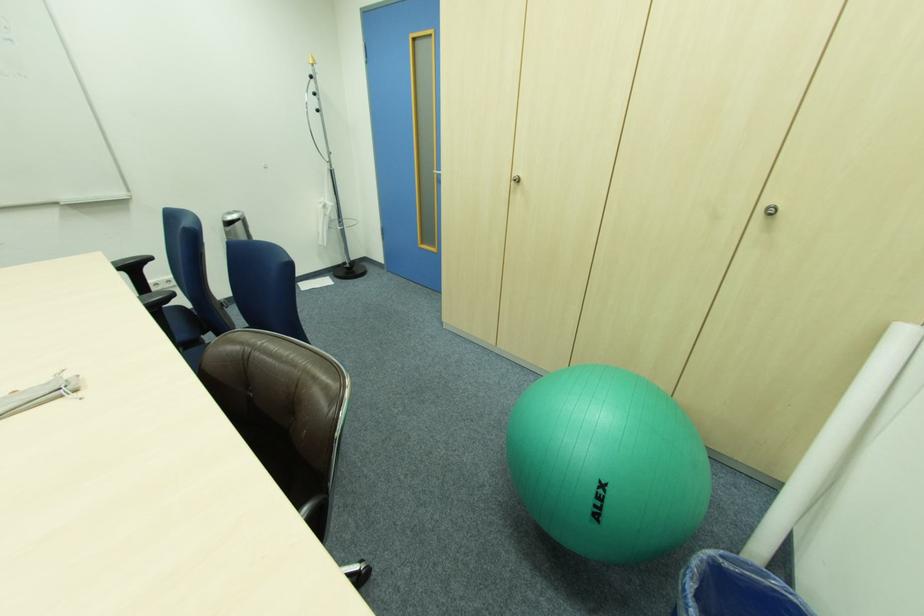
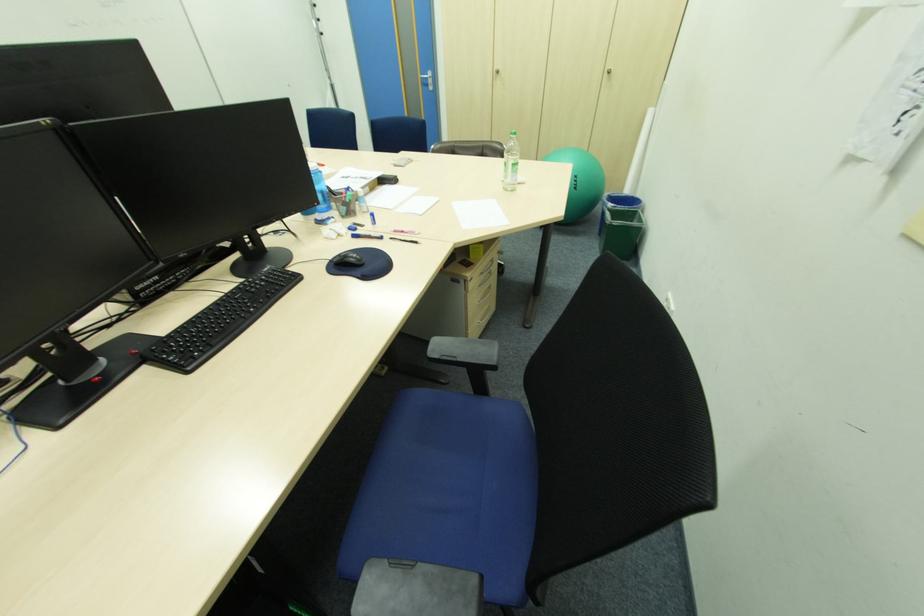
Locate, in the second image, the point that corresponds to the point at 609,487 in the first image.

(581, 177)